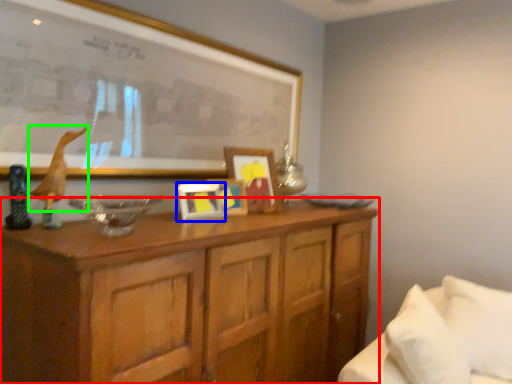
Question: Which object is positioned closest to cabinetry (highlighted by a red box)? Select from picture frame (highlighted by a blue box) and animal (highlighted by a green box).

Choices:
 (A) picture frame
 (B) animal

Answer: (A)